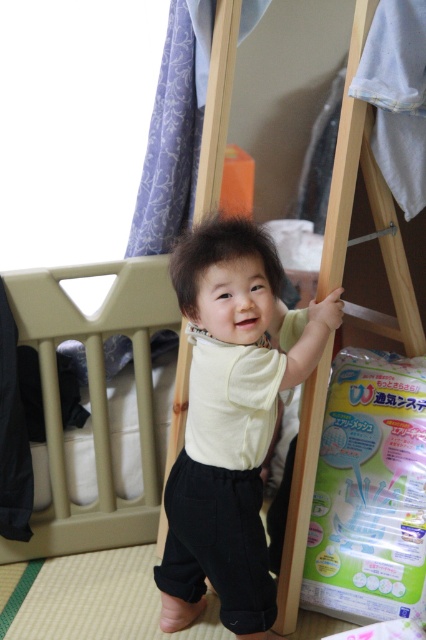
Question: Does matte yellow shirt at center appear on the left side of wooden easel at center?

Choices:
 (A) yes
 (B) no

Answer: (A)

Question: Estimate the real-world distances between objects in this image. Which object is closer to the wooden easel at center?

Choices:
 (A) beige plastic crib at left
 (B) matte yellow shirt at center

Answer: (B)

Question: Is matte yellow shirt at center thinner than wooden easel at center?

Choices:
 (A) yes
 (B) no

Answer: (B)

Question: Which is nearer to the matte yellow shirt at center?

Choices:
 (A) beige plastic crib at left
 (B) wooden easel at center

Answer: (B)

Question: Which object is the closest to the wooden easel at center?

Choices:
 (A) beige plastic crib at left
 (B) matte yellow shirt at center

Answer: (B)

Question: Does beige plastic crib at left appear under wooden easel at center?

Choices:
 (A) no
 (B) yes

Answer: (A)